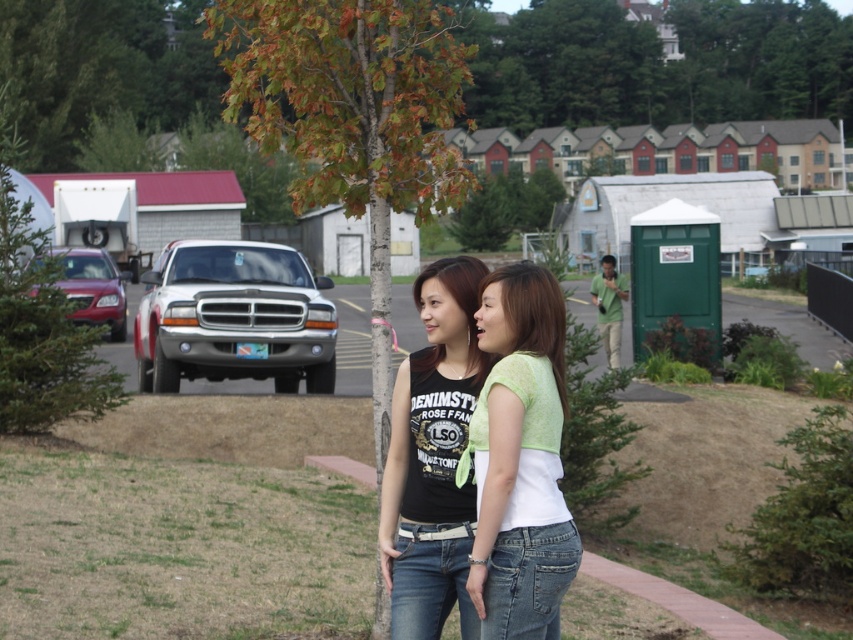
Question: Is green leafy tree at center below green cotton shirt at center?

Choices:
 (A) no
 (B) yes

Answer: (A)

Question: Among these points, which one is farthest from the camera?

Choices:
 (A) (465, 52)
 (B) (416, 548)
 (C) (474, 570)

Answer: (A)

Question: Can you confirm if green leafy tree at center is thinner than green cotton shirt at center?

Choices:
 (A) no
 (B) yes

Answer: (A)

Question: Which of the following is the closest to the observer?

Choices:
 (A) green leafy tree at center
 (B) green cotton shirt at center

Answer: (B)

Question: Does green cotton shirt at center have a larger size compared to black matte tank top at center?

Choices:
 (A) yes
 (B) no

Answer: (B)

Question: Which of these objects is positioned farthest from the black matte tank top at center?

Choices:
 (A) green cotton shirt at center
 (B) green leafy tree at center

Answer: (B)